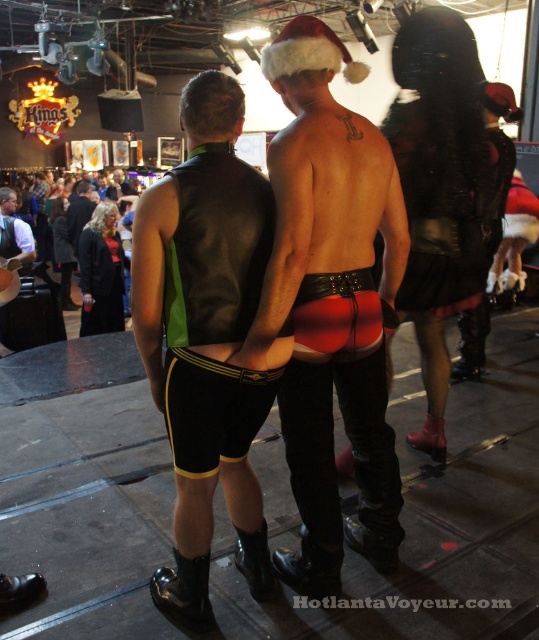
Which of these two, shiny leather shorts at center or black leather vest at center, stands shorter?

With less height is black leather vest at center.

The image size is (539, 640). I want to click on shiny leather shorts at center, so click(x=330, y=305).

Which is behind, point (328, 428) or point (247, 580)?

The point (247, 580) is more distant.

This screenshot has height=640, width=539. I want to click on shiny leather shorts at center, so click(x=330, y=305).